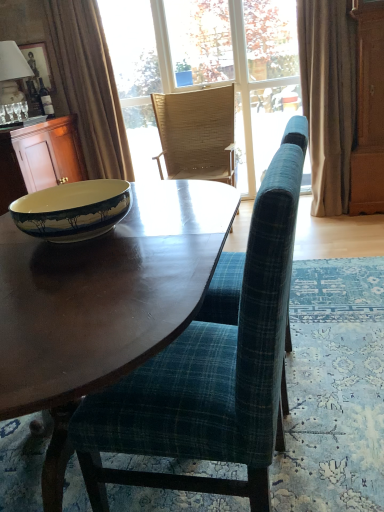
What is the approximate height of wooden screen door at right?

A: wooden screen door at right is 1.50 meters in height.

Locate an element on the screen. matte glass bottle at upper left is located at coordinates (46, 100).

The image size is (384, 512). What do you see at coordinates (46, 100) in the screenshot?
I see `matte glass bottle at upper left` at bounding box center [46, 100].

Describe the element at coordinates (328, 98) in the screenshot. The image size is (384, 512). I see `beige fabric curtain at right, arranged as the 2th curtain when viewed from the left` at that location.

The height and width of the screenshot is (512, 384). What do you see at coordinates (39, 63) in the screenshot?
I see `wooden picture frame at upper left` at bounding box center [39, 63].

In order to face wooden cabinet at left, should I rotate leftwards or rightwards?

Rotate your view left by about 21.690°.

Find the location of a particular element. The height and width of the screenshot is (512, 384). wooden screen door at right is located at coordinates (368, 110).

Is brown fabric curtain at upper left, which is the first curtain in left-to-right order, to the right of wooden picture frame at upper left from the viewer's perspective?

Yes, brown fabric curtain at upper left, which is the first curtain in left-to-right order, is to the right of wooden picture frame at upper left.

Can wooden picture frame at upper left be found inside brown fabric curtain at upper left, the 2th curtain in the right-to-left sequence?

No, wooden picture frame at upper left is not surrounded by brown fabric curtain at upper left, the 2th curtain in the right-to-left sequence.

Could you tell me if brown fabric curtain at upper left, the 2th curtain in the right-to-left sequence, is turned towards wooden picture frame at upper left?

No, brown fabric curtain at upper left, the 2th curtain in the right-to-left sequence, does not turn towards wooden picture frame at upper left.

From the image's perspective, which one is positioned lower, wooden picture frame at upper left or brown fabric curtain at upper left, which is the first curtain in left-to-right order?

brown fabric curtain at upper left, which is the first curtain in left-to-right order, is shown below in the image.

Is wooden picture frame at upper left behind brown fabric curtain at upper left, which is the first curtain in left-to-right order?

Yes.

Do you think wooden picture frame at upper left is within brown fabric curtain at upper left, which is the first curtain in left-to-right order, or outside of it?

wooden picture frame at upper left exists outside the volume of brown fabric curtain at upper left, which is the first curtain in left-to-right order.

Considering the sizes of clear glass window at center and white fabric lampshade at upper left in the image, is clear glass window at center taller or shorter than white fabric lampshade at upper left?

Considering their sizes, clear glass window at center has more height than white fabric lampshade at upper left.

Based on the photo, which object is further away from the camera, clear glass window at center or white fabric lampshade at upper left?

clear glass window at center is further from the camera.

How far apart are clear glass window at center and white fabric lampshade at upper left?

A distance of 4.28 feet exists between clear glass window at center and white fabric lampshade at upper left.

Is clear glass window at center not close to white fabric lampshade at upper left?

clear glass window at center is positioned a significant distance from white fabric lampshade at upper left.

In the scene shown: Would you say brown fabric curtain at upper left, the 2th curtain in the right-to-left sequence, is outside wooden desk at center?

Yes, brown fabric curtain at upper left, the 2th curtain in the right-to-left sequence, is located beyond the bounds of wooden desk at center.

From a real-world perspective, is brown fabric curtain at upper left, the 2th curtain in the right-to-left sequence, physically located above or below wooden desk at center?

brown fabric curtain at upper left, the 2th curtain in the right-to-left sequence, is above wooden desk at center.

Looking at this image, from the image's perspective, which is above, brown fabric curtain at upper left, the 2th curtain in the right-to-left sequence, or wooden desk at center?

brown fabric curtain at upper left, the 2th curtain in the right-to-left sequence, is shown above in the image.

Where is `curtain that is on the left side of wooden desk at center`? curtain that is on the left side of wooden desk at center is located at coordinates (89, 85).

Looking at this image, is clear glass window at center placed right next to matte ceramic bowl at left?

No, clear glass window at center is not touching matte ceramic bowl at left.

From the image's perspective, is clear glass window at center above or below matte ceramic bowl at left?

Based on their image positions, clear glass window at center is located above matte ceramic bowl at left.

How much distance is there between clear glass window at center and matte ceramic bowl at left?

2.20 meters.

Can you tell me how much clear glass window at center and matte ceramic bowl at left differ in facing direction?

The facing directions of clear glass window at center and matte ceramic bowl at left are 84.4 degrees apart.

Is woven wood chair at center, the second chair viewed from the front, facing towards wooden cabinet at left?

No, woven wood chair at center, the second chair viewed from the front, is not oriented towards wooden cabinet at left.

Is woven wood chair at center, the second chair viewed from the front, surrounding wooden cabinet at left?

Actually, wooden cabinet at left is outside woven wood chair at center, the second chair viewed from the front.

Locate an element on the screen. The width and height of the screenshot is (384, 512). chair that appears behind the wooden cabinet at left is located at coordinates (196, 134).

Considering the relative positions of woven wood chair at center, the 1th chair when ordered from back to front, and wooden cabinet at left in the image provided, is woven wood chair at center, the 1th chair when ordered from back to front, to the right of wooden cabinet at left from the viewer's perspective?

Correct, you'll find woven wood chair at center, the 1th chair when ordered from back to front, to the right of wooden cabinet at left.

Does matte glass bottle at upper left turn towards wooden desk at center?

No, matte glass bottle at upper left is not facing towards wooden desk at center.

Between matte glass bottle at upper left and wooden desk at center, which one has smaller width?

matte glass bottle at upper left is thinner.

Considering the relative positions of matte glass bottle at upper left and wooden desk at center in the image provided, is matte glass bottle at upper left to the left of wooden desk at center from the viewer's perspective?

Correct, you'll find matte glass bottle at upper left to the left of wooden desk at center.

From the image's perspective, relative to wooden desk at center, is matte glass bottle at upper left above or below?

Based on their image positions, matte glass bottle at upper left is located above wooden desk at center.

Find the location of `picture frame positioned vertically above the brown fabric curtain at upper left, the 2th curtain in the right-to-left sequence (from a real-world perspective)`. picture frame positioned vertically above the brown fabric curtain at upper left, the 2th curtain in the right-to-left sequence (from a real-world perspective) is located at coordinates (39, 63).

Locate an element on the screen. The height and width of the screenshot is (512, 384). the 1st curtain in front when counting from the wooden picture frame at upper left is located at coordinates (89, 85).

Estimate the real-world distances between objects in this image. Which object is further from brown fabric curtain at upper left, the 2th curtain in the right-to-left sequence, plaid fabric chair at center, which is the second chair in top-to-bottom order, or woven wood chair at center, the second chair viewed from the front?

The object further to brown fabric curtain at upper left, the 2th curtain in the right-to-left sequence, is plaid fabric chair at center, which is the second chair in top-to-bottom order.

Looking at this image, which object lies further to the anchor point beige fabric curtain at right, arranged as the 2th curtain when viewed from the left, wooden cabinet at left or plaid fabric chair at center, which is the first chair from bottom to top?

plaid fabric chair at center, which is the first chair from bottom to top.

Estimate the real-world distances between objects in this image. Which object is further from wooden desk at center, matte glass bottle at upper left or wooden cabinet at left?

matte glass bottle at upper left lies further to wooden desk at center than the other object.

When comparing their distances from brown fabric curtain at upper left, the 2th curtain in the right-to-left sequence, does clear glass window at center or matte ceramic bowl at left seem further?

matte ceramic bowl at left lies further to brown fabric curtain at upper left, the 2th curtain in the right-to-left sequence, than the other object.

Which object lies nearer to the anchor point wooden cabinet at left, wooden screen door at right or matte glass bottle at upper left?

matte glass bottle at upper left lies closer to wooden cabinet at left than the other object.

Which object lies further to the anchor point wooden picture frame at upper left, matte glass bottle at upper left or clear glass window at center?

Based on the image, clear glass window at center appears to be further to wooden picture frame at upper left.

From the image, which object appears to be nearer to clear glass window at center, wooden desk at center or wooden picture frame at upper left?

wooden picture frame at upper left is closer to clear glass window at center.

When comparing their distances from beige fabric curtain at right, arranged as the 2th curtain when viewed from the left, does woven wood chair at center, the 1th chair when ordered from back to front, or white fabric lampshade at upper left seem closer?

woven wood chair at center, the 1th chair when ordered from back to front, lies closer to beige fabric curtain at right, arranged as the 2th curtain when viewed from the left, than the other object.

The image size is (384, 512). Find the location of `chair between plaid fabric chair at center, which ranks as the second chair in back-to-front order, and wooden picture frame at upper left in the front-back direction`. chair between plaid fabric chair at center, which ranks as the second chair in back-to-front order, and wooden picture frame at upper left in the front-back direction is located at coordinates (196, 134).

The height and width of the screenshot is (512, 384). I want to click on picture frame between white fabric lampshade at upper left and woven wood chair at center, the 1th chair when ordered from back to front, from left to right, so coord(39,63).

You are a GUI agent. You are given a task and a screenshot of the screen. Output one action in this format:
    pyautogui.click(x=<x>, y=<y>)
    Task: Click on the chair between wooden desk at center and wooden screen door at right from front to back
    
    Given the screenshot: What is the action you would take?
    pyautogui.click(x=211, y=370)

Find the location of a particular element. screen door located between plaid fabric chair at center, which is the first chair from bottom to top, and beige fabric curtain at right, arranged as the 2th curtain when viewed from the left, in the depth direction is located at coordinates (368, 110).